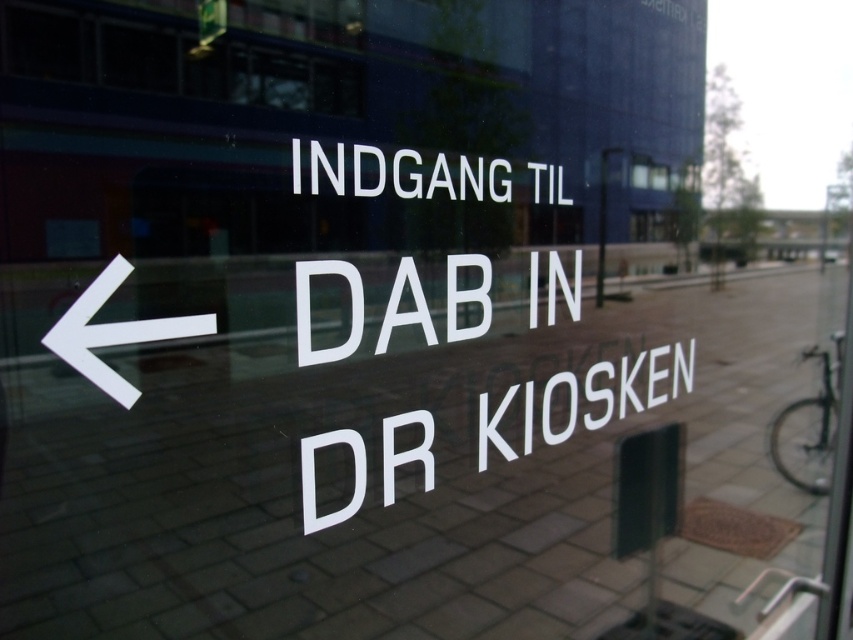
Is white glossy arrow at left shorter than transparent glass window at upper center?

Incorrect, white glossy arrow at left's height does not fall short of transparent glass window at upper center's.

How much distance is there between white glossy arrow at left and transparent glass window at upper center?

white glossy arrow at left and transparent glass window at upper center are 97.81 centimeters apart from each other.

Is point (107, 381) positioned before point (641, 163)?

Yes.

The image size is (853, 640). What are the coordinates of `white glossy arrow at left` in the screenshot? It's located at coord(113,332).

Does white text at center appear on the right side of white glossy arrow at left?

Yes, white text at center is to the right of white glossy arrow at left.

Is point (474, 193) positioned before point (109, 323)?

No, it is behind (109, 323).

Locate an element on the screen. white text at center is located at coordinates (408, 173).

Does white glossy text at center have a greater height compared to white matte text at center?

Yes.

Is white glossy text at center thinner than white matte text at center?

No, white glossy text at center is not thinner than white matte text at center.

The height and width of the screenshot is (640, 853). I want to click on white glossy text at center, so click(x=635, y=384).